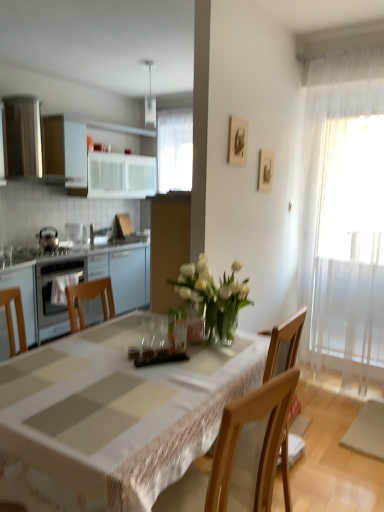
Question: Is white sheer curtain at right directly adjacent to white glass vase at center?

Choices:
 (A) yes
 (B) no

Answer: (B)

Question: Is white glass vase at center located within white sheer curtain at right?

Choices:
 (A) no
 (B) yes

Answer: (A)

Question: Is white sheer curtain at right wider than white glass vase at center?

Choices:
 (A) yes
 (B) no

Answer: (B)

Question: Can you confirm if white sheer curtain at right is thinner than white glass vase at center?

Choices:
 (A) no
 (B) yes

Answer: (B)

Question: From a real-world perspective, is white sheer curtain at right on top of white glass vase at center?

Choices:
 (A) no
 (B) yes

Answer: (B)

Question: From the image's perspective, is white sheer curtain at right below white glass vase at center?

Choices:
 (A) no
 (B) yes

Answer: (A)

Question: Is white clothed table at center not close to satin silver oven at left?

Choices:
 (A) no
 (B) yes

Answer: (B)

Question: From the image's perspective, is white clothed table at center above satin silver oven at left?

Choices:
 (A) no
 (B) yes

Answer: (A)

Question: Is satin silver oven at left at the back of white clothed table at center?

Choices:
 (A) no
 (B) yes

Answer: (A)

Question: Considering the relative sizes of white clothed table at center and satin silver oven at left in the image provided, is white clothed table at center shorter than satin silver oven at left?

Choices:
 (A) no
 (B) yes

Answer: (A)

Question: Is white clothed table at center smaller than satin silver oven at left?

Choices:
 (A) yes
 (B) no

Answer: (B)

Question: Is white clothed table at center further to the viewer compared to satin silver oven at left?

Choices:
 (A) no
 (B) yes

Answer: (A)

Question: Is satin silver oven at left directly adjacent to wooden picture frame at upper center, positioned as the 1th picture frame in left-to-right order?

Choices:
 (A) yes
 (B) no

Answer: (B)